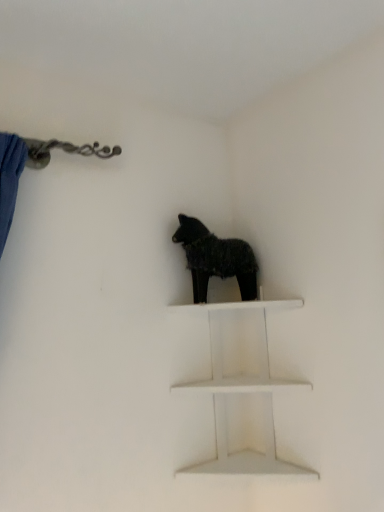
Question: From the image's perspective, is white matte shelf at center located beneath black furry dog at center?

Choices:
 (A) yes
 (B) no

Answer: (A)

Question: From the image's perspective, is white matte shelf at center above black furry dog at center?

Choices:
 (A) yes
 (B) no

Answer: (B)

Question: Is white matte shelf at center positioned with its back to black furry dog at center?

Choices:
 (A) yes
 (B) no

Answer: (B)

Question: Would you say white matte shelf at center is outside black furry dog at center?

Choices:
 (A) no
 (B) yes

Answer: (B)

Question: Can you confirm if white matte shelf at center is shorter than black furry dog at center?

Choices:
 (A) no
 (B) yes

Answer: (A)

Question: From a real-world perspective, is white matte shelf at center positioned under black furry dog at center based on gravity?

Choices:
 (A) no
 (B) yes

Answer: (B)

Question: Does black furry dog at center have a lesser height compared to white matte shelf at center?

Choices:
 (A) yes
 (B) no

Answer: (A)

Question: Is there a large distance between black furry dog at center and white matte shelf at center?

Choices:
 (A) no
 (B) yes

Answer: (A)

Question: Could you tell me if black furry dog at center is turned towards white matte shelf at center?

Choices:
 (A) no
 (B) yes

Answer: (A)

Question: Is black furry dog at center taller than white matte shelf at center?

Choices:
 (A) yes
 (B) no

Answer: (B)

Question: Can you confirm if black furry dog at center is thinner than white matte shelf at center?

Choices:
 (A) no
 (B) yes

Answer: (B)

Question: Could white matte shelf at center be considered to be inside black furry dog at center?

Choices:
 (A) yes
 (B) no

Answer: (B)

Question: From their relative heights in the image, would you say white matte shelf at center is taller or shorter than black furry dog at center?

Choices:
 (A) short
 (B) tall

Answer: (B)